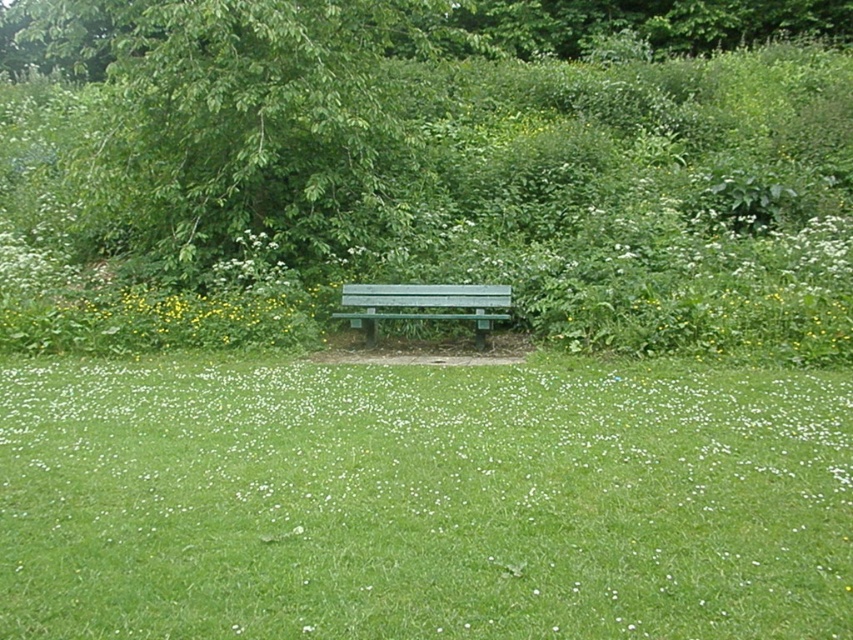
In the scene shown: You are planning to place a small potted plant between the green grass at center and the green painted wood bench at center. Based on their positions, which object should the potted plant be closer to?

The green grass at center is positioned on the left side of the green painted wood bench at center, so the potted plant should be placed closer to the green grass at center to maintain symmetry between the two objects.

You are planning to place a new garden statue that requires a 3x3 meter space. Given the scene, can the green grass at center and the green leafy tree at upper left accommodate this statue without overlapping either?

The green grass at center is smaller than the green leafy tree at upper left, but the description does not provide specific measurements of their sizes. Therefore, it is unclear if there is enough space between them to place a 3x3 meter statue without overlapping.